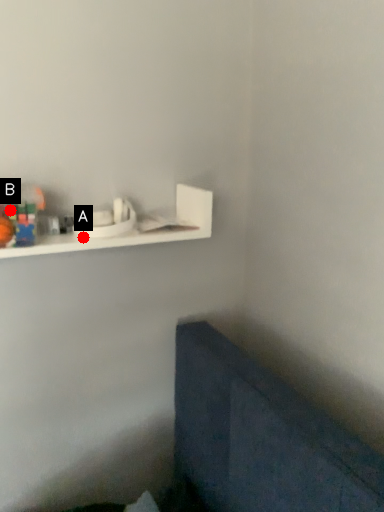
Question: Two points are circled on the image, labeled by A and B beside each circle. Which point is closer to the camera?

Choices:
 (A) A is closer
 (B) B is closer

Answer: (B)